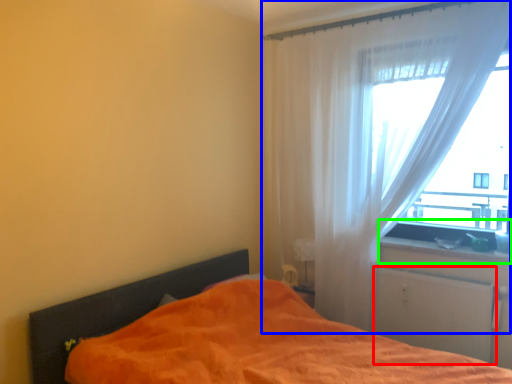
Question: Estimate the real-world distances between objects in this image. Which object is farther from screen door (highlighted by a red box), curtain (highlighted by a blue box) or window sill (highlighted by a green box)?

Choices:
 (A) curtain
 (B) window sill

Answer: (A)